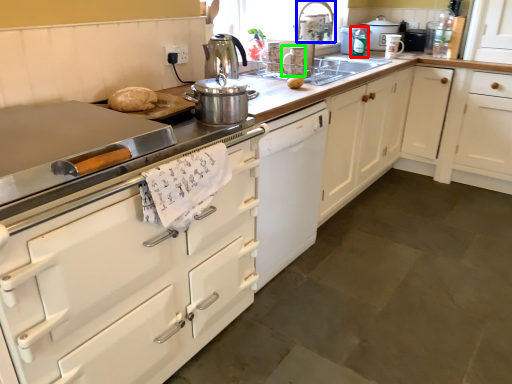
Question: Which is farther away from kitchen appliance (highlighted by a red box)? faucet (highlighted by a blue box) or kitchen appliance (highlighted by a green box)?

Choices:
 (A) faucet
 (B) kitchen appliance

Answer: (B)